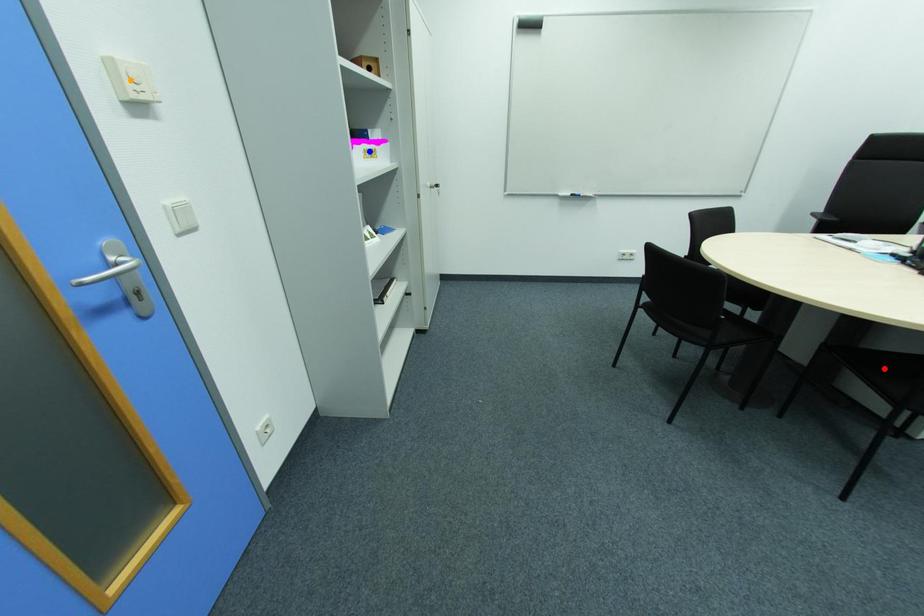
Order these from nearest to farthest:
A) orange point
B) blue point
C) red point

orange point → red point → blue point